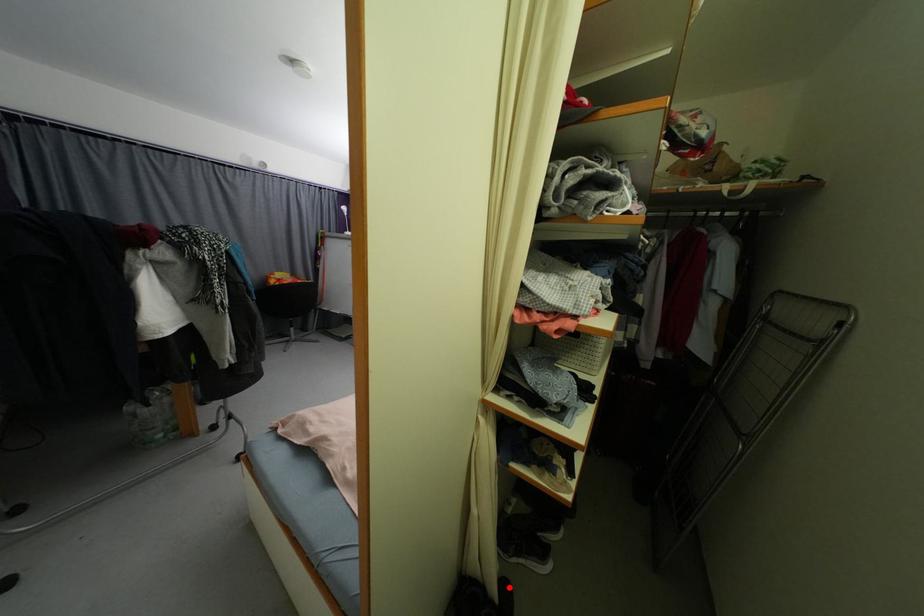
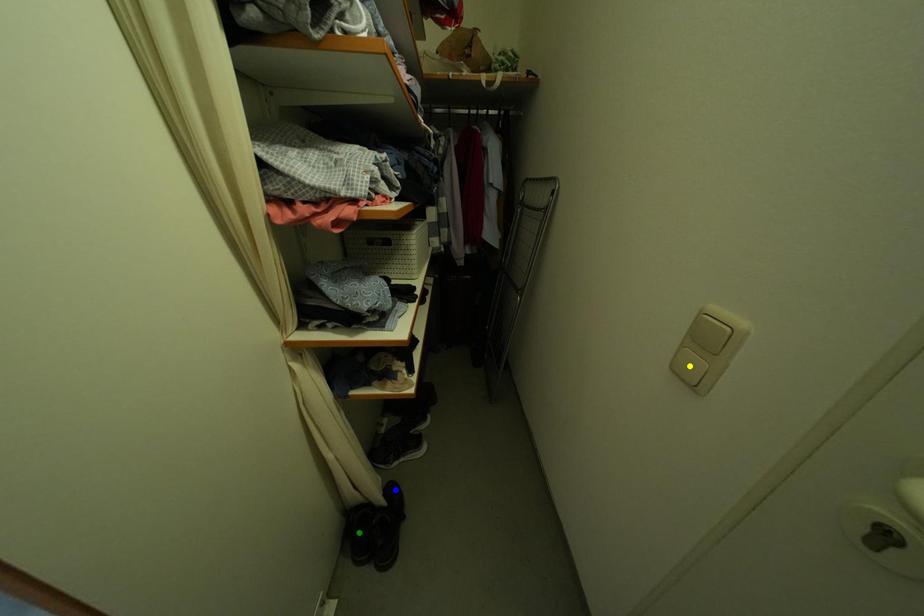
Question: I am providing you with two images of the same scene from different viewpoints. A red point is marked on the first image. You are given multiple points on the second image. Which point in image 2 is actually the same real-world point as the red point in image 1?

Choices:
 (A) green point
 (B) blue point
 (C) yellow point

Answer: (B)